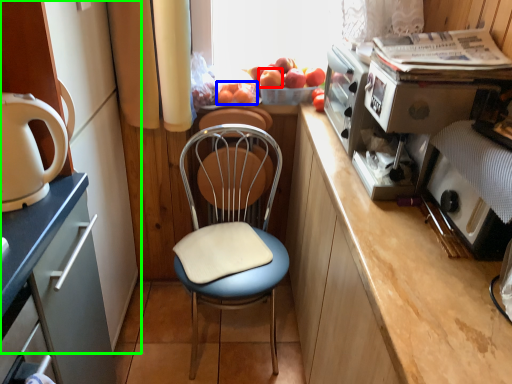
Question: Considering the real-world distances, which object is farthest from apple (highlighted by a red box)? fruit (highlighted by a blue box) or cabinetry (highlighted by a green box)?

Choices:
 (A) fruit
 (B) cabinetry

Answer: (B)